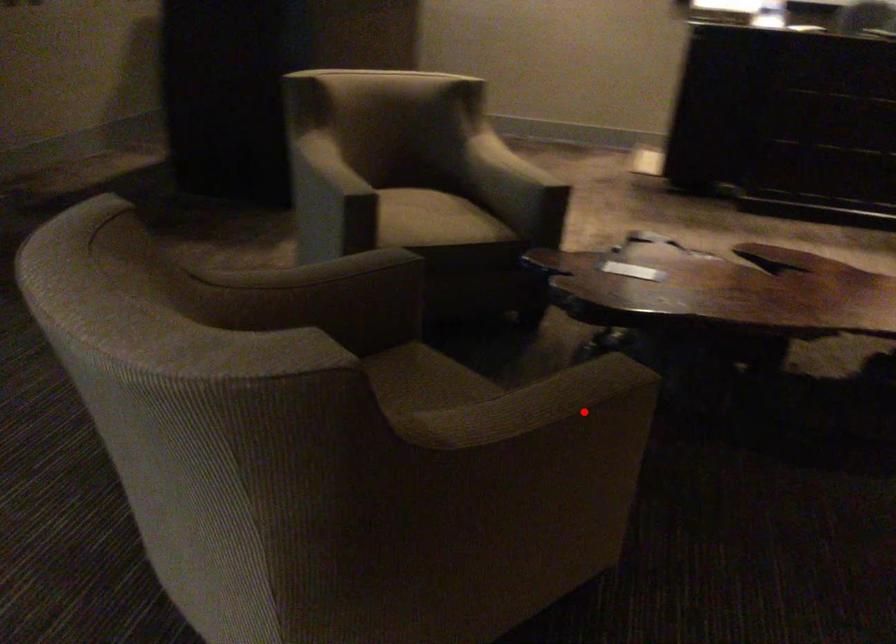
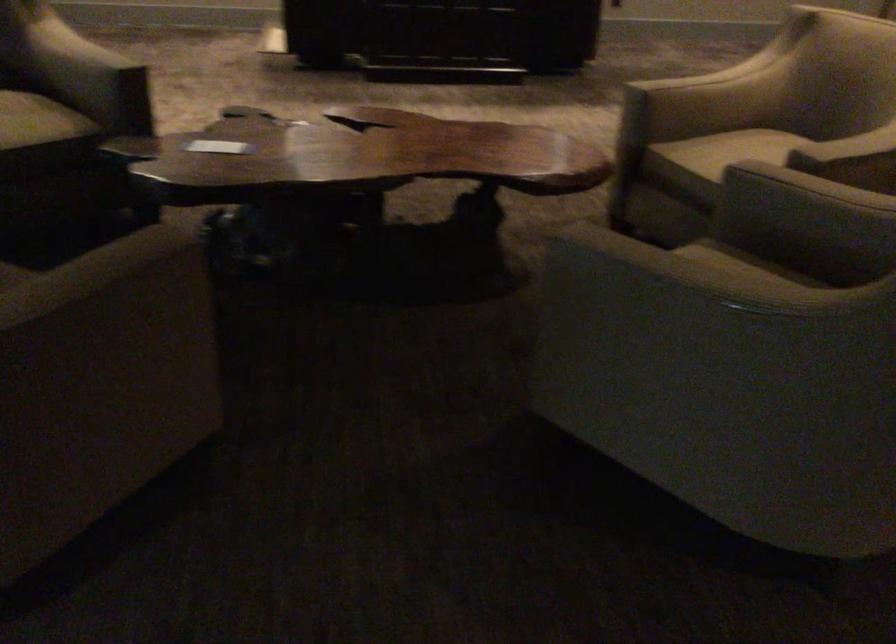
Where in the second image is the point corresponding to the highlighted location from the first image?

(128, 287)